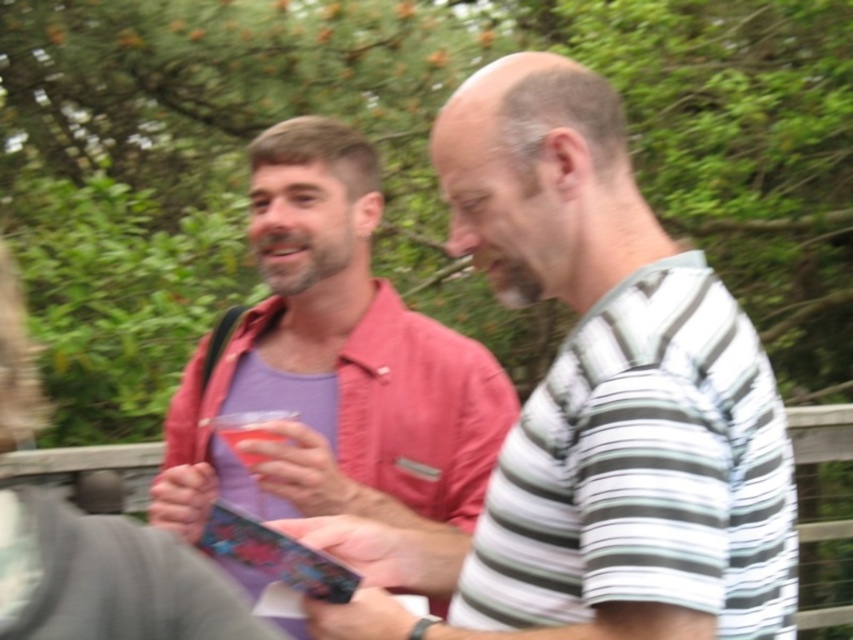
Does matte pink shirt at left come in front of translucent plastic cup at center?

Yes, it is in front of translucent plastic cup at center.

Can you confirm if matte pink shirt at left is thinner than translucent plastic cup at center?

No, matte pink shirt at left is not thinner than translucent plastic cup at center.

Is point (335, 196) positioned in front of point (229, 433)?

No.

At what (x,y) coordinates should I click in order to perform the action: click on matte pink shirt at left. Please return your answer as a coordinate pair (x, y). Looking at the image, I should click on (334, 364).

The height and width of the screenshot is (640, 853). What are the coordinates of `matte pink shirt at center` in the screenshot? It's located at tap(592, 404).

Which is in front, point (747, 433) or point (253, 435)?

Positioned in front is point (747, 433).

Image resolution: width=853 pixels, height=640 pixels. What are the coordinates of `matte pink shirt at center` in the screenshot? It's located at (592, 404).

Can you confirm if matte pink shirt at center is bigger than matte pink shirt at left?

Yes.

Can you confirm if matte pink shirt at center is positioned to the right of matte pink shirt at left?

Indeed, matte pink shirt at center is positioned on the right side of matte pink shirt at left.

Image resolution: width=853 pixels, height=640 pixels. What do you see at coordinates (592, 404) in the screenshot?
I see `matte pink shirt at center` at bounding box center [592, 404].

Locate an element on the screen. Image resolution: width=853 pixels, height=640 pixels. matte pink shirt at center is located at coordinates (592, 404).